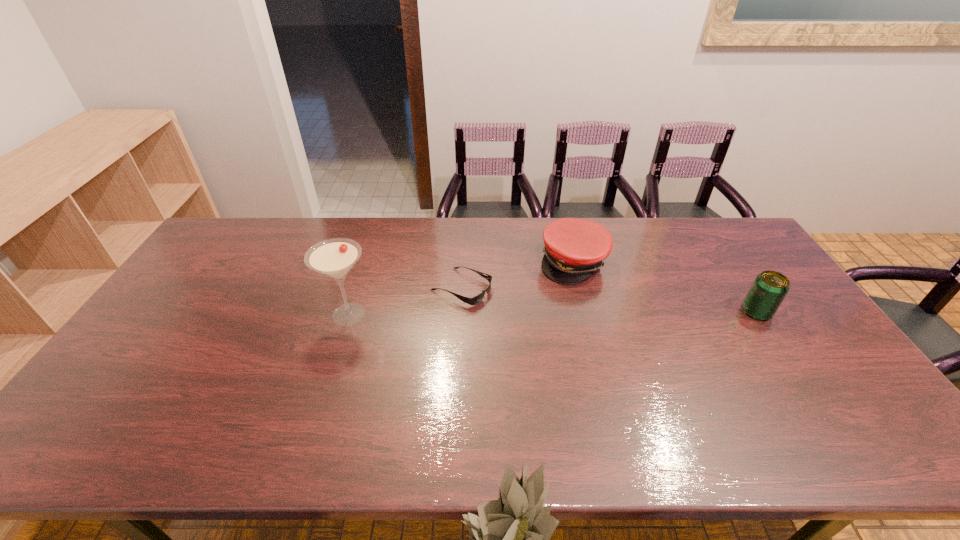
At what (x,y) coordinates should I click in order to perform the action: click on the tallest object. Please return your answer as a coordinate pair (x, y). The image size is (960, 540). Looking at the image, I should click on (334, 258).

Where is `martini`? Image resolution: width=960 pixels, height=540 pixels. martini is located at coordinates (334, 258).

What are the coordinates of `beer can` in the screenshot? It's located at (769, 288).

Locate an element on the screen. This screenshot has width=960, height=540. the second object from left to right is located at coordinates (475, 300).

Identify the location of sunglasses. The height and width of the screenshot is (540, 960). (475, 300).

Where is `the third object from left to right`? This screenshot has height=540, width=960. the third object from left to right is located at coordinates (574, 248).

You are a GUI agent. You are given a task and a screenshot of the screen. Output one action in this format:
    pyautogui.click(x=<x>, y=<y>)
    Task: Click on the vacant space situated 0.170m on the front of the tallest object
    The width and height of the screenshot is (960, 540).
    Given the screenshot: What is the action you would take?
    pyautogui.click(x=327, y=383)

Locate an element on the screen. The image size is (960, 540). free location located 0.250m on the front of the rightmost object is located at coordinates (812, 396).

You are a GUI agent. You are given a task and a screenshot of the screen. Output one action in this format:
    pyautogui.click(x=<x>, y=<y>)
    Task: Click on the free region located 0.050m on the front-facing side of the shortest object
    This screenshot has height=540, width=960.
    Given the screenshot: What is the action you would take?
    pyautogui.click(x=501, y=304)

The height and width of the screenshot is (540, 960). I want to click on free spot located on the front-facing side of the shortest object, so click(609, 351).